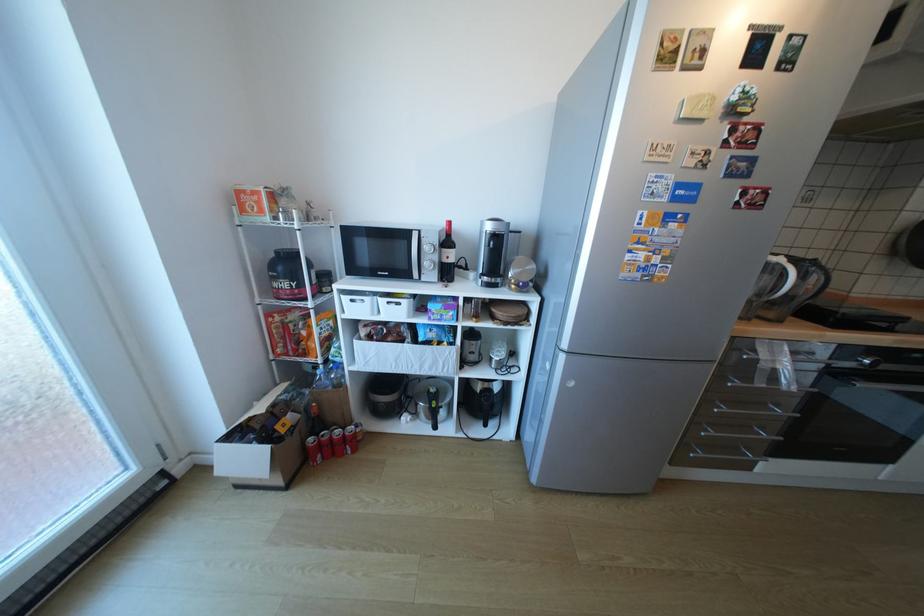
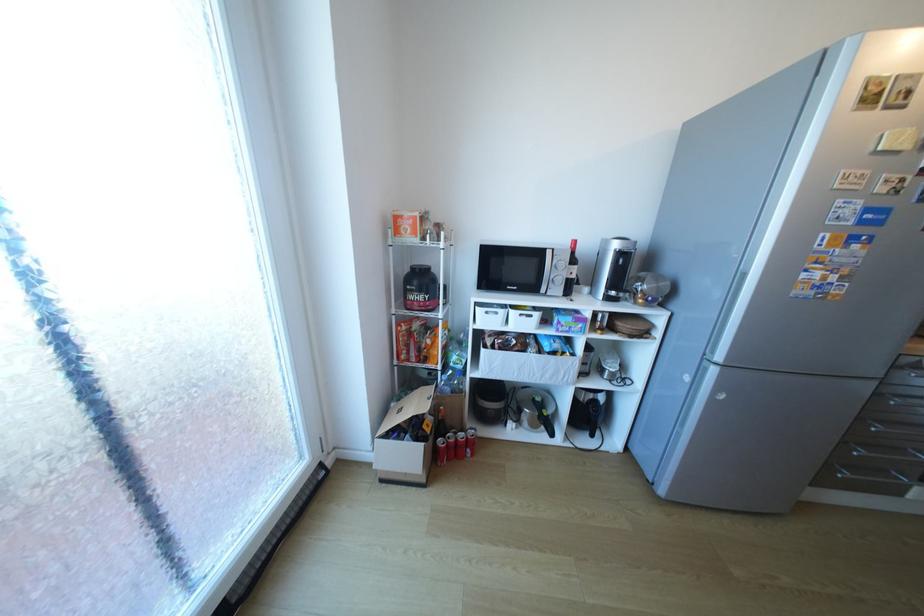
In the second image, find the point that corresponds to [250,440] in the first image.

(407, 437)